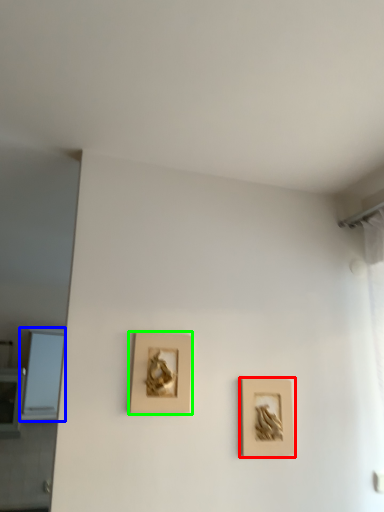
Question: Based on their relative distances, which object is farther from picture frame (highlighted by a red box)? Choose from window (highlighted by a blue box) and picture frame (highlighted by a green box).

Choices:
 (A) window
 (B) picture frame

Answer: (A)